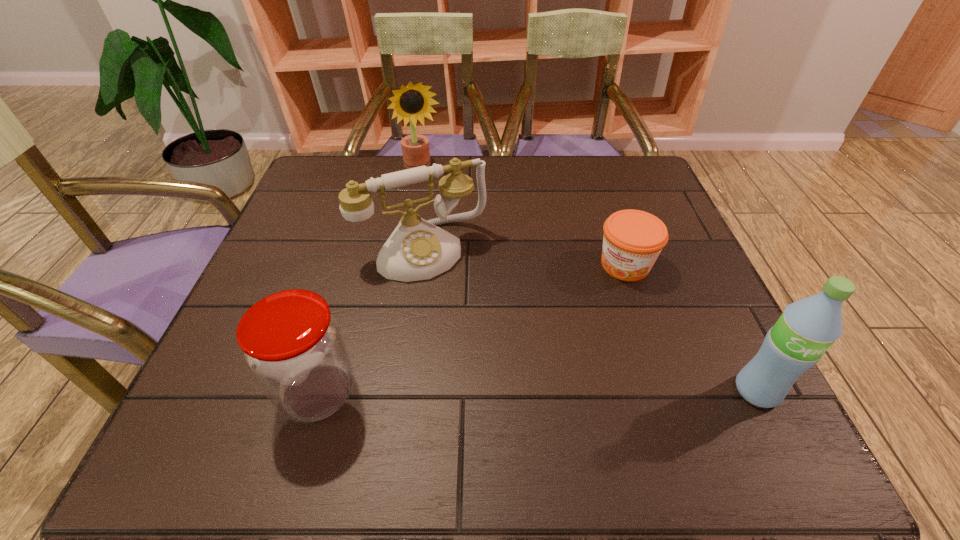
Where is `blank space at the far right corner`? blank space at the far right corner is located at coordinates tap(652, 197).

This screenshot has height=540, width=960. Find the location of `blank region between the jar and the telephone`. blank region between the jar and the telephone is located at coordinates (370, 321).

Where is `empty space between the water bottle and the shortest object`? empty space between the water bottle and the shortest object is located at coordinates (691, 328).

Locate an element on the screen. vacant space that's between the sunflower and the telephone is located at coordinates (422, 208).

The image size is (960, 540). Identify the location of vacant area between the telephone and the sunflower. (422, 208).

The width and height of the screenshot is (960, 540). I want to click on vacant point located between the farthest object and the telephone, so click(x=422, y=208).

Identify the location of free point between the jam and the jar. (471, 329).

The image size is (960, 540). What are the coordinates of `free space between the jar and the farthest object` in the screenshot? It's located at (371, 280).

Identify the location of vacant area that lies between the jar and the farthest object. (371, 280).

Image resolution: width=960 pixels, height=540 pixels. What are the coordinates of `vacant space that is in between the water bottle and the telephone` in the screenshot? It's located at (589, 320).